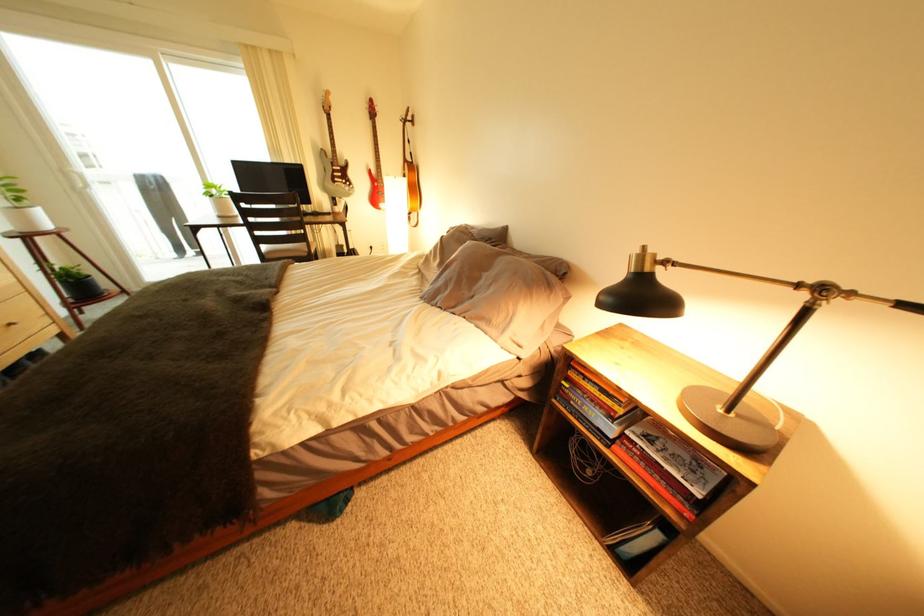
Find the location of a particular element. The height and width of the screenshot is (616, 924). black plant pot is located at coordinates (78, 284).